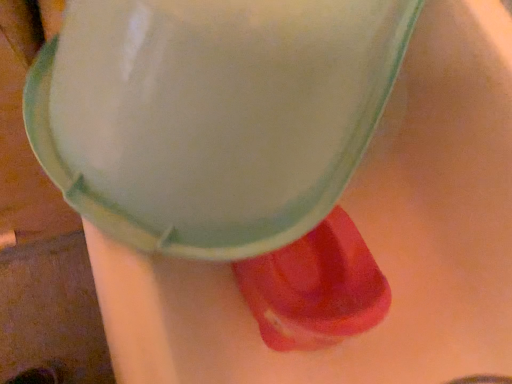
Question: Should I look upward or downward to see rubberized red shoe at lower right?

Choices:
 (A) down
 (B) up

Answer: (A)

Question: Does matte white foam at center turn towards rubberized red shoe at lower right?

Choices:
 (A) no
 (B) yes

Answer: (A)

Question: Is the depth of matte white foam at center greater than that of rubberized red shoe at lower right?

Choices:
 (A) no
 (B) yes

Answer: (A)

Question: Does matte white foam at center appear on the left side of rubberized red shoe at lower right?

Choices:
 (A) no
 (B) yes

Answer: (B)

Question: From a real-world perspective, is matte white foam at center physically above rubberized red shoe at lower right?

Choices:
 (A) no
 (B) yes

Answer: (B)

Question: Does matte white foam at center have a lesser height compared to rubberized red shoe at lower right?

Choices:
 (A) yes
 (B) no

Answer: (B)

Question: Is matte white foam at center beside rubberized red shoe at lower right?

Choices:
 (A) no
 (B) yes

Answer: (A)

Question: From the image's perspective, does rubberized red shoe at lower right appear lower than matte white foam at center?

Choices:
 (A) yes
 (B) no

Answer: (A)

Question: Is rubberized red shoe at lower right placed right next to matte white foam at center?

Choices:
 (A) yes
 (B) no

Answer: (B)

Question: From a real-world perspective, is rubberized red shoe at lower right over matte white foam at center?

Choices:
 (A) yes
 (B) no

Answer: (B)

Question: Is rubberized red shoe at lower right at the right side of matte white foam at center?

Choices:
 (A) no
 (B) yes

Answer: (B)

Question: Would you say rubberized red shoe at lower right is a long distance from matte white foam at center?

Choices:
 (A) no
 (B) yes

Answer: (A)

Question: Considering the relative sizes of rubberized red shoe at lower right and matte white foam at center in the image provided, is rubberized red shoe at lower right smaller than matte white foam at center?

Choices:
 (A) yes
 (B) no

Answer: (A)

Question: Considering their positions, is matte white foam at center located in front of or behind rubberized red shoe at lower right?

Choices:
 (A) behind
 (B) front

Answer: (B)